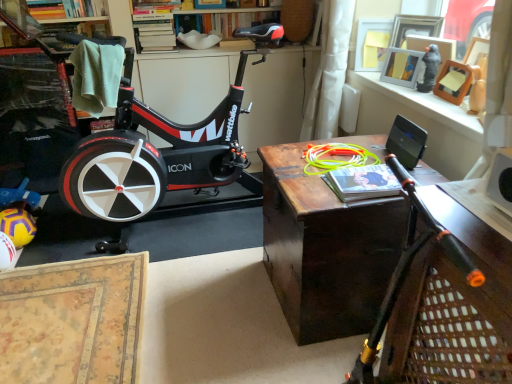
Question: Is black plastic speaker at upper right at the left side of black matte stationary bicycle at center?

Choices:
 (A) no
 (B) yes

Answer: (A)

Question: Is black plastic speaker at upper right not close to black matte stationary bicycle at center?

Choices:
 (A) no
 (B) yes

Answer: (B)

Question: Is black plastic speaker at upper right outside of black matte stationary bicycle at center?

Choices:
 (A) no
 (B) yes

Answer: (B)

Question: Does black plastic speaker at upper right have a lesser width compared to black matte stationary bicycle at center?

Choices:
 (A) no
 (B) yes

Answer: (B)

Question: Considering the relative sizes of black plastic speaker at upper right and black matte stationary bicycle at center in the image provided, is black plastic speaker at upper right smaller than black matte stationary bicycle at center?

Choices:
 (A) no
 (B) yes

Answer: (B)

Question: Based on their sizes in the image, would you say dark wood table at center is bigger or smaller than hardcover book at upper left, which is the second book in right-to-left order?

Choices:
 (A) small
 (B) big

Answer: (B)

Question: In the image, is dark wood table at center positioned in front of or behind hardcover book at upper left, which is the 1th book in top-to-bottom order?

Choices:
 (A) front
 (B) behind

Answer: (A)

Question: Considering the positions of point (262, 157) and point (27, 1), is point (262, 157) closer or farther from the camera than point (27, 1)?

Choices:
 (A) farther
 (B) closer

Answer: (B)

Question: From the image's perspective, is dark wood table at center above or below hardcover book at upper left, which is the 1th book in top-to-bottom order?

Choices:
 (A) below
 (B) above

Answer: (A)

Question: In terms of height, does wooden frame at upper right look taller or shorter compared to hardcover book at upper left, acting as the second book starting from the front?

Choices:
 (A) tall
 (B) short

Answer: (B)

Question: From a real-world perspective, relative to hardcover book at upper left, which is the second book in right-to-left order, is wooden frame at upper right vertically above or below?

Choices:
 (A) below
 (B) above

Answer: (A)

Question: Looking at the image, does wooden frame at upper right seem bigger or smaller compared to hardcover book at upper left, acting as the 2th book starting from the bottom?

Choices:
 (A) small
 (B) big

Answer: (B)

Question: From the image's perspective, is wooden frame at upper right above or below hardcover book at upper left, acting as the second book starting from the front?

Choices:
 (A) above
 (B) below

Answer: (B)

Question: Is wooden bookshelf at upper center in front of or behind hardcover book at upper left, positioned as the 1th book in back-to-front order, in the image?

Choices:
 (A) front
 (B) behind

Answer: (B)

Question: Considering the positions of wooden bookshelf at upper center and hardcover book at upper left, which is the 1th book in top-to-bottom order, in the image, is wooden bookshelf at upper center taller or shorter than hardcover book at upper left, which is the 1th book in top-to-bottom order,?

Choices:
 (A) short
 (B) tall

Answer: (B)